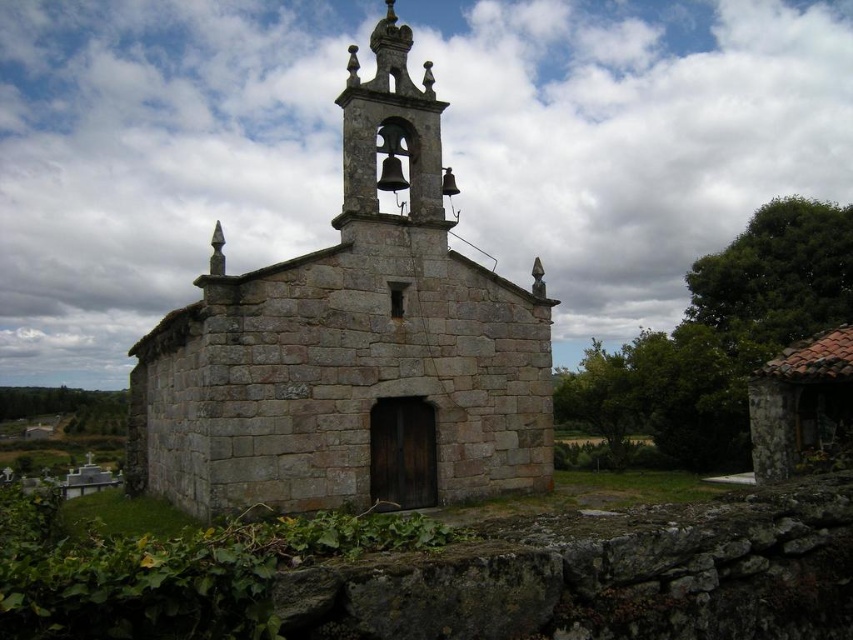
You are standing at the point marked by the coordinates point [352,348] in the image, which is located in the center of the gray stone church. What is the closest object to you in the scene?

The point [352,348] is located at the center of the gray stone church, so the closest object to you would be the gray stone church itself.

Based on the photo, you are standing in front of the stone chapel and notice two points marked on the ground. One is at coordinate point (223,289) and the other is at point (357,100). Which point is closer to you?

Point (223,289) is closer to the viewer than point (357,100).

You are a drone operator planning to fly a drone over the gray stone church at center and the polished bronze bell tower at upper center. Based on their heights, which object will the drone need to ascend higher to capture from above?

The drone will need to ascend higher to capture the gray stone church at center because it has a greater height compared to the polished bronze bell tower at upper center.